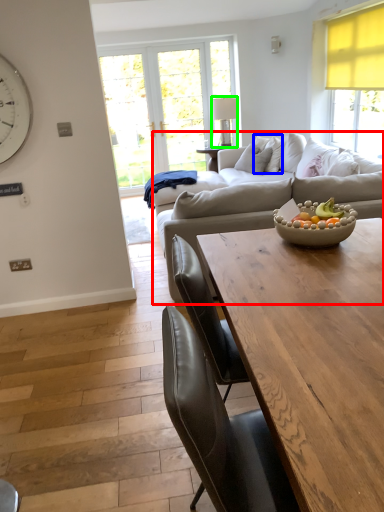
Question: Which object is the closest to the studio couch (highlighted by a red box)? Choose among these: pillow (highlighted by a blue box) or lamp (highlighted by a green box).

Choices:
 (A) pillow
 (B) lamp

Answer: (A)